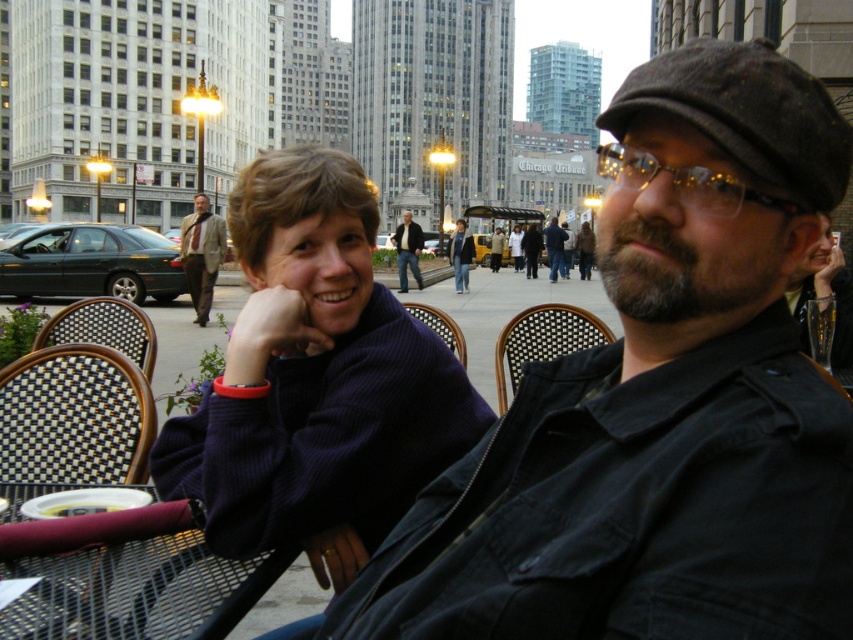
Is point (611, 573) farther from viewer compared to point (409, 256)?

No.

Can you confirm if dark brown fabric cap at upper right is positioned to the left of dark blue jeans at center?

Incorrect, dark brown fabric cap at upper right is not on the left side of dark blue jeans at center.

Does point (831, 445) lie behind point (409, 232)?

No, it is not.

The width and height of the screenshot is (853, 640). What are the coordinates of `dark brown fabric cap at upper right` in the screenshot? It's located at (659, 401).

Who is lower down, metallic silver table at lower left or dark blue jeans at center?

metallic silver table at lower left is below.

Which is behind, point (64, 484) or point (410, 252)?

The point (410, 252) is more distant.

Find the location of a particular element. The image size is (853, 640). metallic silver table at lower left is located at coordinates (137, 589).

This screenshot has width=853, height=640. I want to click on metallic silver table at lower left, so click(x=137, y=589).

Does point (688, 244) lie behind point (83, 588)?

Yes, it is.

The width and height of the screenshot is (853, 640). Describe the element at coordinates (659, 401) in the screenshot. I see `dark brown fabric cap at upper right` at that location.

Locate an element on the screen. dark brown fabric cap at upper right is located at coordinates (659, 401).